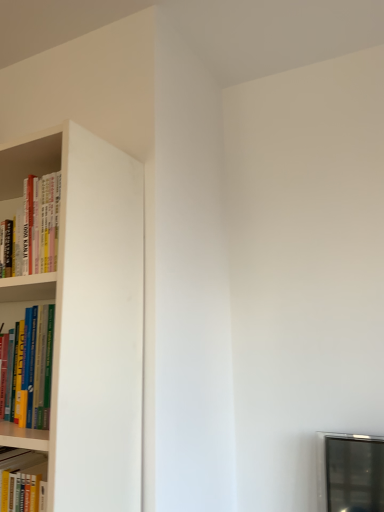
Question: Considering the relative positions of hardcover books at left, arranged as the second book when viewed from the top, and hardcover books at left, which is counted as the 2th book, starting from the front, in the image provided, is hardcover books at left, arranged as the second book when viewed from the top, to the right of hardcover books at left, which is counted as the 2th book, starting from the front, from the viewer's perspective?

Choices:
 (A) no
 (B) yes

Answer: (B)

Question: Does hardcover books at left, the first book positioned from the front, have a lesser width compared to hardcover books at left, the second book positioned from the bottom?

Choices:
 (A) yes
 (B) no

Answer: (A)

Question: Is hardcover books at left, the first book positioned from the front, facing towards hardcover books at left, the first book positioned from the back?

Choices:
 (A) yes
 (B) no

Answer: (B)

Question: Can you confirm if hardcover books at left, arranged as the first book when ordered from the bottom, is positioned to the left of hardcover books at left, the first book positioned from the back?

Choices:
 (A) yes
 (B) no

Answer: (B)

Question: From the image's perspective, is hardcover books at left, arranged as the first book when ordered from the bottom, located beneath hardcover books at left, the second book positioned from the bottom?

Choices:
 (A) yes
 (B) no

Answer: (A)

Question: Considering the relative sizes of hardcover books at left, the second book positioned from the bottom, and hardcover books at left, the 2th book in the back-to-front sequence, in the image provided, is hardcover books at left, the second book positioned from the bottom, thinner than hardcover books at left, the 2th book in the back-to-front sequence,?

Choices:
 (A) no
 (B) yes

Answer: (A)

Question: Is hardcover books at left, the first book positioned from the back, positioned beyond the bounds of hardcover books at left, the first book positioned from the front?

Choices:
 (A) no
 (B) yes

Answer: (B)

Question: Is hardcover books at left, the 1th book viewed from the top, smaller than hardcover books at left, the 2th book in the back-to-front sequence?

Choices:
 (A) yes
 (B) no

Answer: (B)

Question: From a real-world perspective, is hardcover books at left, the second book positioned from the bottom, over hardcover books at left, the first book positioned from the front?

Choices:
 (A) no
 (B) yes

Answer: (B)

Question: Can you confirm if hardcover books at left, the first book positioned from the back, is shorter than hardcover books at left, the first book positioned from the front?

Choices:
 (A) yes
 (B) no

Answer: (A)

Question: Is hardcover books at left, which is counted as the 2th book, starting from the front, bigger than hardcover books at left, arranged as the first book when ordered from the bottom?

Choices:
 (A) no
 (B) yes

Answer: (B)

Question: Is hardcover books at left, arranged as the first book when ordered from the bottom, bigger or smaller than hardcover books at left, the first book positioned from the back?

Choices:
 (A) big
 (B) small

Answer: (B)